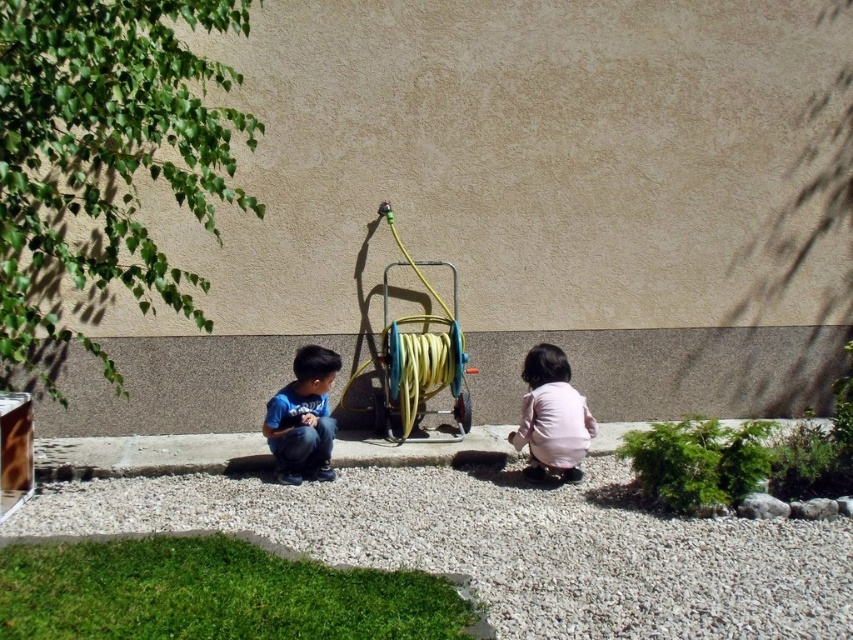
Question: Does pink matte shirt at lower center have a larger size compared to gray rough stone at lower right?

Choices:
 (A) no
 (B) yes

Answer: (B)

Question: Which object is positioned farthest from the gray rough stone at lower right?

Choices:
 (A) blue cotton shirt at lower center
 (B) pink matte shirt at lower center
 (C) white gravel at lower right

Answer: (A)

Question: Which of the following is the farthest from the observer?

Choices:
 (A) (546, 428)
 (B) (813, 518)

Answer: (A)

Question: Where is blue cotton shirt at lower center located in relation to white gravel at lower right in the image?

Choices:
 (A) above
 (B) below

Answer: (A)

Question: Is blue cotton shirt at lower center closer to the viewer compared to white gravel at lower right?

Choices:
 (A) yes
 (B) no

Answer: (B)

Question: Which object appears closest to the camera in this image?

Choices:
 (A) white gravel at lower center
 (B) pink matte shirt at lower center

Answer: (A)